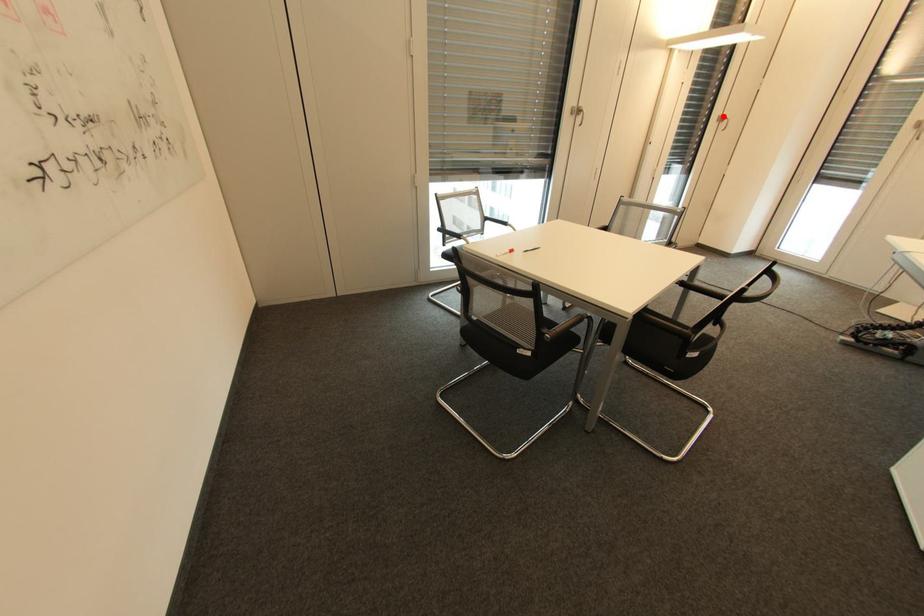
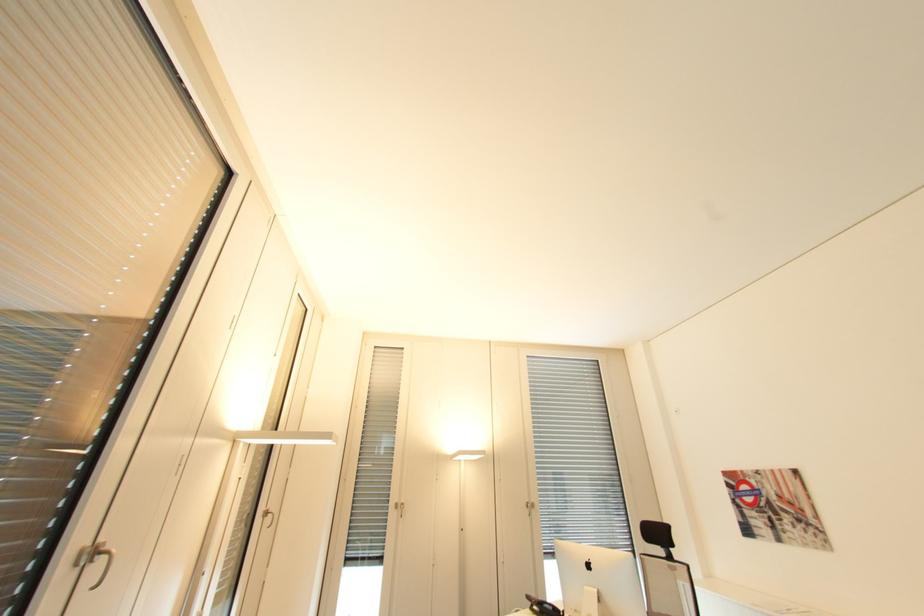
In the second image, find the point that corresponds to the highlighted location in the first image.

(270, 511)